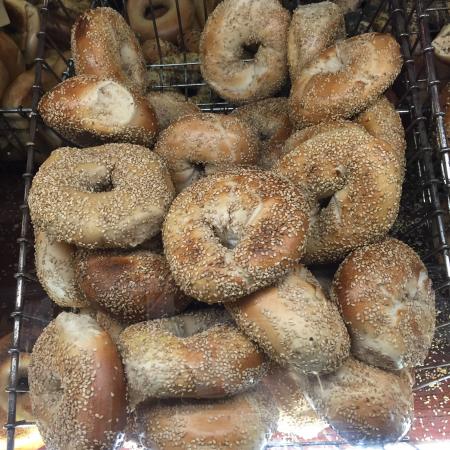
Where is `seeds on wood table`? This screenshot has width=450, height=450. seeds on wood table is located at coordinates (447, 399), (428, 401), (444, 342), (441, 306), (420, 241).